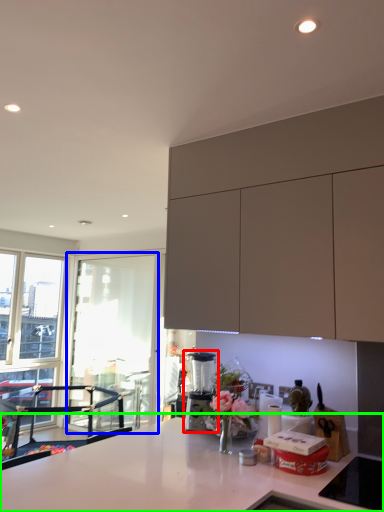
Question: Which object is positioned closest to coffee machine (highlighted by a red box)? Select from window screen (highlighted by a blue box) and countertop (highlighted by a green box).

Choices:
 (A) window screen
 (B) countertop

Answer: (B)